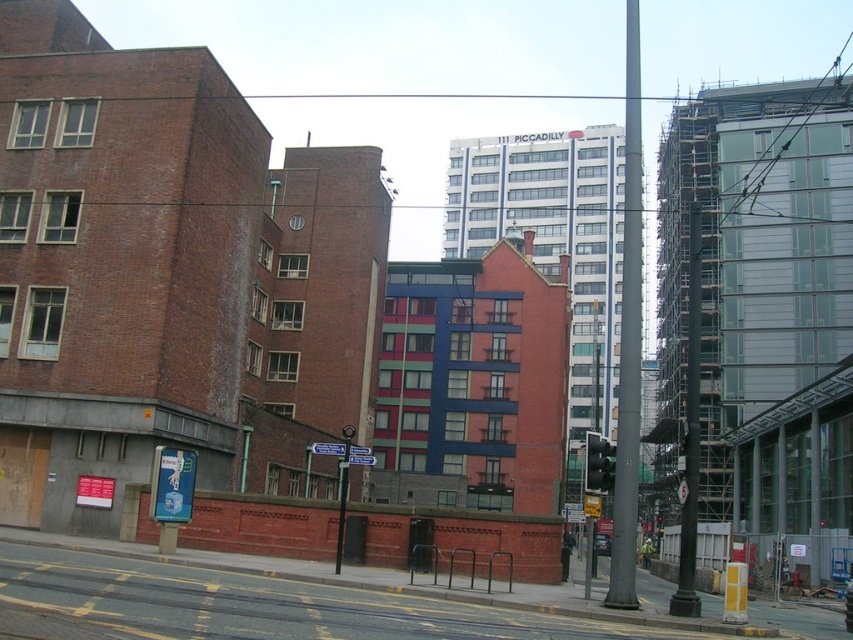
Question: Can you confirm if metallic gray pole at center is wider than black glass traffic light at center?

Choices:
 (A) no
 (B) yes

Answer: (B)

Question: In this image, where is metallic gray pole at center located relative to black glass traffic light at center?

Choices:
 (A) above
 (B) below

Answer: (A)

Question: Among these points, which one is nearest to the camera?

Choices:
 (A) (593, 440)
 (B) (639, 52)

Answer: (A)

Question: Where is metallic gray pole at center located in relation to black glass traffic light at center in the image?

Choices:
 (A) above
 (B) below

Answer: (A)